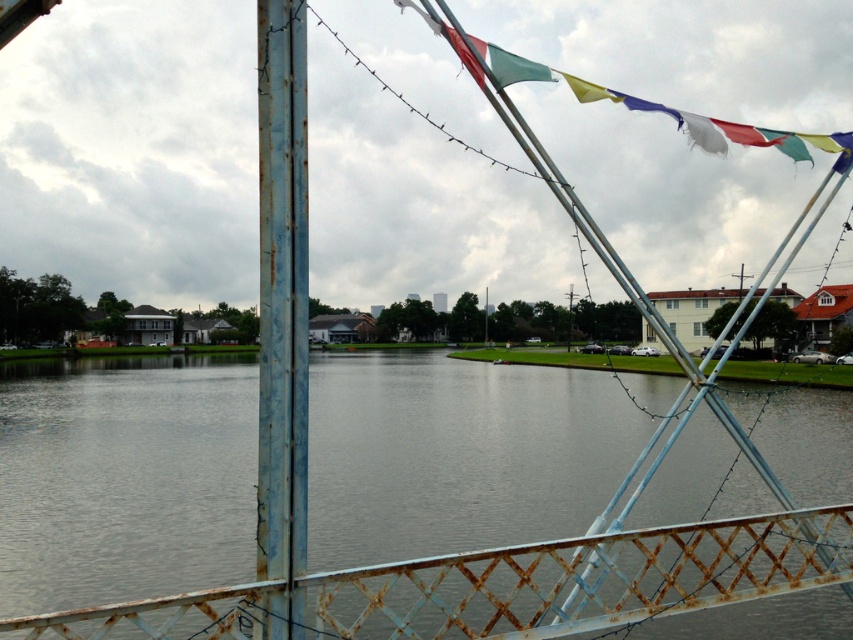
You are standing on the bridge and want to know how far the point at coordinates (263, 301) is from you. Can you determine the distance?

The distance of point (263, 301) from camera is 5.94 meters, so the point is 5.94 meters away from you.

You are standing on the bridge and want to take a photo of the gray metallic water at center. Where should you aim your camera to capture it?

You should aim your camera at point (125, 480) to capture the gray metallic water at center.

You are standing on the bridge looking down at the scene. The gray metallic water at center and the rusty metal pole at left are both in your line of sight. Which object appears wider from your perspective?

The gray metallic water at center appears wider than the rusty metal pole at left because its width is larger than that of the rusty metal pole at left.